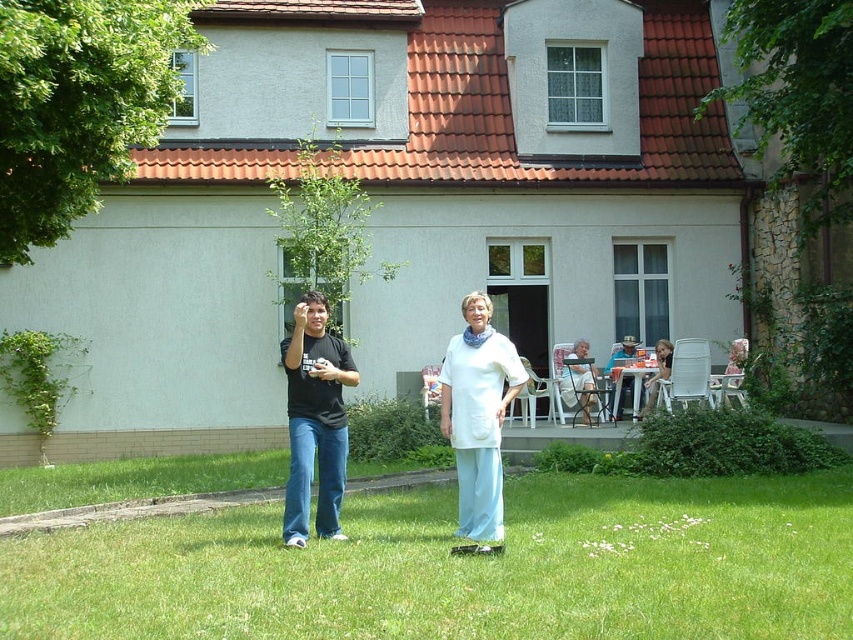
You are standing at the camera position and want to hand a small gift to the person wearing the white cotton shirt at center. Can you reach them without moving from your current position?

The white cotton shirt at center is 25.01 feet away from the camera, so you cannot reach them without moving from your current position.

Looking at this image, you are planning to set up a picnic blanket in the scene described. The picnic blanket is 2 meters wide. Considering the green grass at lower center and the white cotton shirt at center, which area would be more suitable for placing the blanket without overlapping any objects?

The white cotton shirt at center is larger than the green grass at lower center, so placing the picnic blanket on the white cotton shirt at center would be more suitable as it has enough space to accommodate the blanket without overlapping other objects.